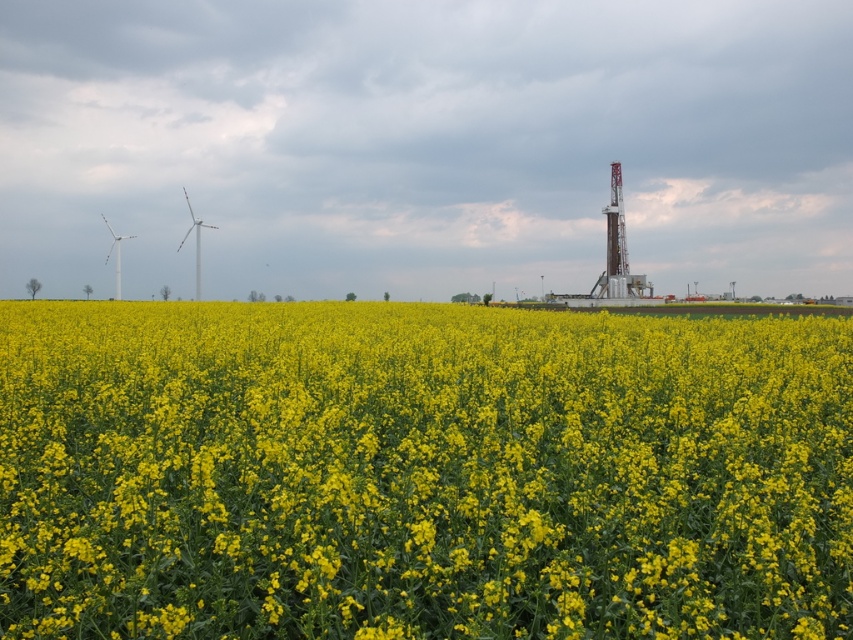
Question: Does yellow matte flower at center appear on the left side of white composite windmill at left?

Choices:
 (A) yes
 (B) no

Answer: (B)

Question: Can you confirm if yellow matte flower at center is positioned to the right of white composite windmill at left?

Choices:
 (A) no
 (B) yes

Answer: (B)

Question: Which object appears closest to the camera in this image?

Choices:
 (A) white composite windmill at left
 (B) yellow matte flower at center

Answer: (B)

Question: Which point is farther to the camera?

Choices:
 (A) white composite windmill at left
 (B) yellow matte flower at center
 (C) white metallic windmill at left

Answer: (C)

Question: Can you confirm if yellow matte flower at center is positioned above white composite windmill at left?

Choices:
 (A) no
 (B) yes

Answer: (A)

Question: Which point is farther from the camera taking this photo?

Choices:
 (A) (198, 218)
 (B) (459, 360)

Answer: (A)